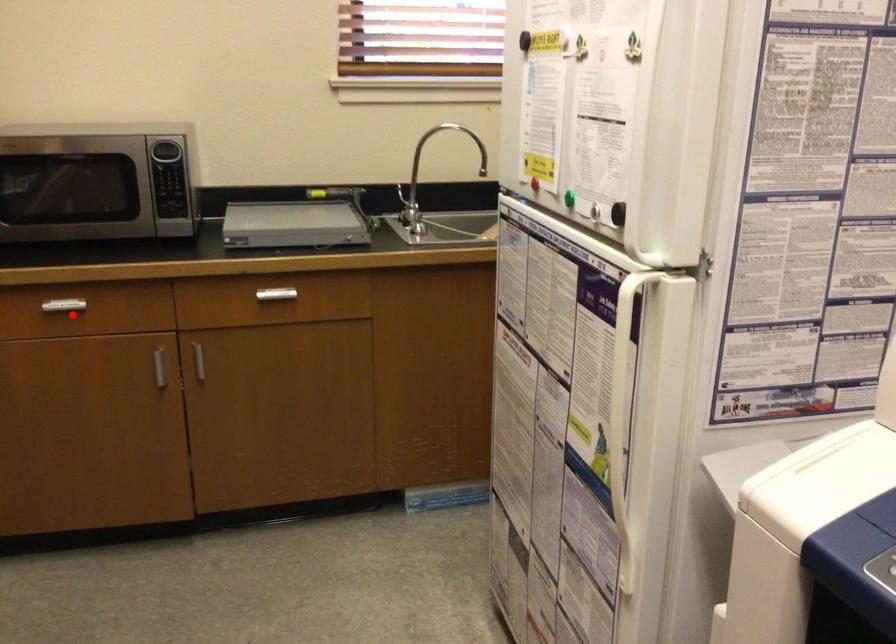
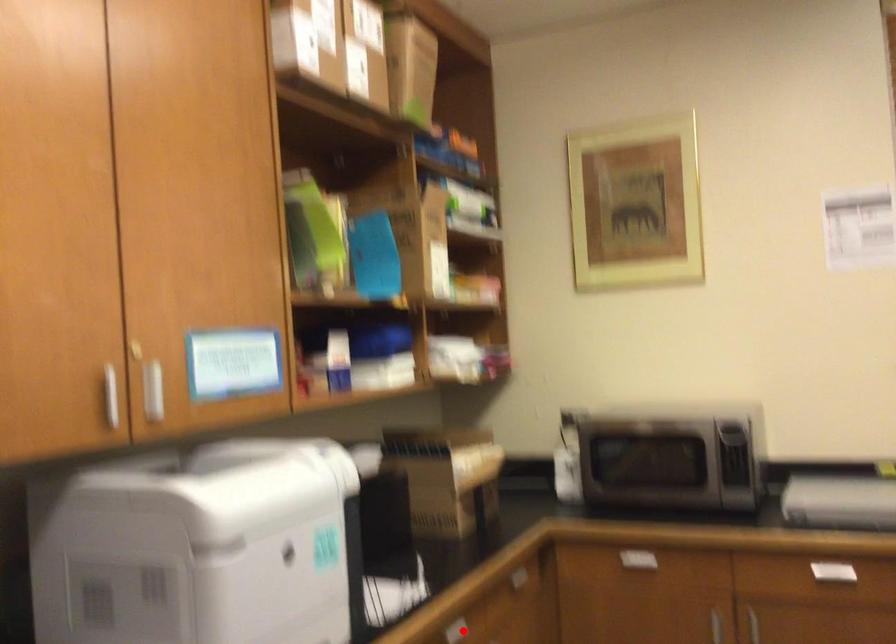
I am providing you with two images of the same scene from different viewpoints. A red point is marked on the first image and another point is marked on the second image. Are the points marked in image1 and image2 representing the same 3D position?

No